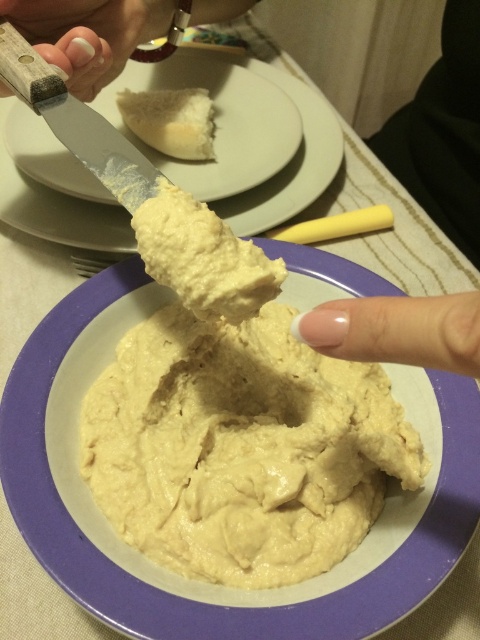
You are a food stylist arranging items on a table. You have a nail polish at upper left and a white crumbly biscuit at upper center. Which item is wider?

The nail polish at upper left has a lesser width compared to the white crumbly biscuit at upper center, so the white crumbly biscuit at upper center is wider.

You are a chef trying to determine if the creamy beige hummus at center can fit into a container that is the same height as the white polished nail at center. Based on their heights, will the hummus overflow?

The creamy beige hummus at center is taller than the white polished nail at center. Since the container is only as tall as the nail, the hummus will overflow when placed inside.

You are a chef who needs to place the nail polish at upper left and the white crumbly biscuit at upper center onto a 10 inch diameter plate. Can both items fit on the plate without overlapping?

The distance between the nail polish at upper left and the white crumbly biscuit at upper center is 9.29 inches. Since the plate has a diameter of 10 inches, there is enough space to place both items on the plate without overlapping as the distance between them is less than the plate size.